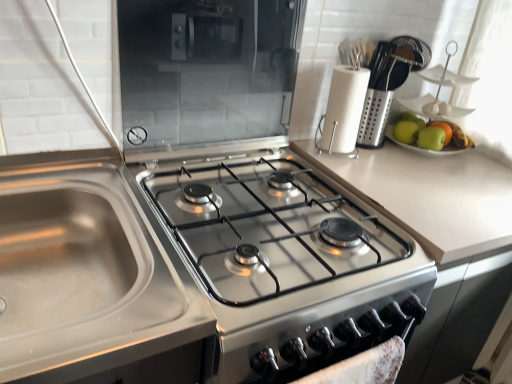
Question: Does stainless steel gas stove at center turn towards transparent glass microwave at upper center?

Choices:
 (A) no
 (B) yes

Answer: (A)

Question: Considering the relative sizes of stainless steel gas stove at center and transparent glass microwave at upper center in the image provided, is stainless steel gas stove at center taller than transparent glass microwave at upper center?

Choices:
 (A) no
 (B) yes

Answer: (A)

Question: Can you confirm if stainless steel gas stove at center is thinner than transparent glass microwave at upper center?

Choices:
 (A) no
 (B) yes

Answer: (A)

Question: From the image's perspective, is stainless steel gas stove at center located above transparent glass microwave at upper center?

Choices:
 (A) yes
 (B) no

Answer: (B)

Question: Can you confirm if stainless steel gas stove at center is wider than transparent glass microwave at upper center?

Choices:
 (A) yes
 (B) no

Answer: (A)

Question: Relative to transparent glass microwave at upper center, is white paper towel at upper right in front or behind?

Choices:
 (A) front
 (B) behind

Answer: (B)

Question: Based on their sizes in the image, would you say white paper towel at upper right is bigger or smaller than transparent glass microwave at upper center?

Choices:
 (A) small
 (B) big

Answer: (A)

Question: From a real-world perspective, is white paper towel at upper right above or below transparent glass microwave at upper center?

Choices:
 (A) below
 (B) above

Answer: (A)

Question: From the image's perspective, relative to transparent glass microwave at upper center, is white paper towel at upper right above or below?

Choices:
 (A) below
 (B) above

Answer: (A)

Question: Is green matte apple at upper right, which ranks as the third apple in right-to-left order, wider or thinner than stainless steel gas stove at center?

Choices:
 (A) wide
 (B) thin

Answer: (B)

Question: From the image's perspective, is green matte apple at upper right, which ranks as the third apple in right-to-left order, located above or below stainless steel gas stove at center?

Choices:
 (A) above
 (B) below

Answer: (A)

Question: In terms of height, does green matte apple at upper right, which ranks as the third apple in right-to-left order, look taller or shorter compared to stainless steel gas stove at center?

Choices:
 (A) short
 (B) tall

Answer: (A)

Question: Considering the relative positions of green matte apple at upper right, which ranks as the third apple in right-to-left order, and stainless steel gas stove at center in the image provided, is green matte apple at upper right, which ranks as the third apple in right-to-left order, to the left or to the right of stainless steel gas stove at center?

Choices:
 (A) left
 (B) right

Answer: (B)

Question: Does point (x=184, y=175) appear closer or farther from the camera than point (x=187, y=130)?

Choices:
 (A) farther
 (B) closer

Answer: (B)

Question: Considering the positions of stainless steel gas stove at center and transparent glass microwave at upper center in the image, is stainless steel gas stove at center wider or thinner than transparent glass microwave at upper center?

Choices:
 (A) thin
 (B) wide

Answer: (B)